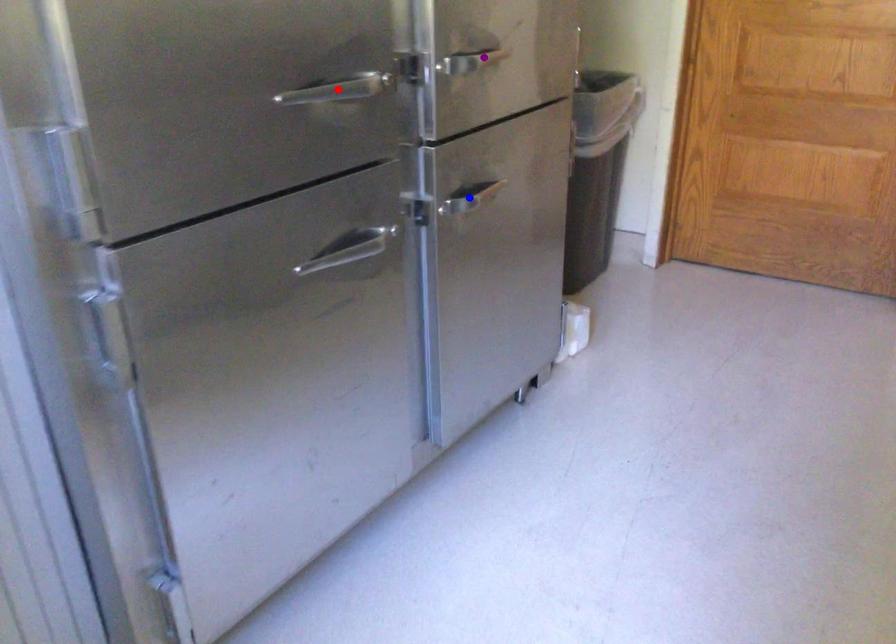
Order these from farthest to nearest:
blue point | purple point | red point

purple point → blue point → red point